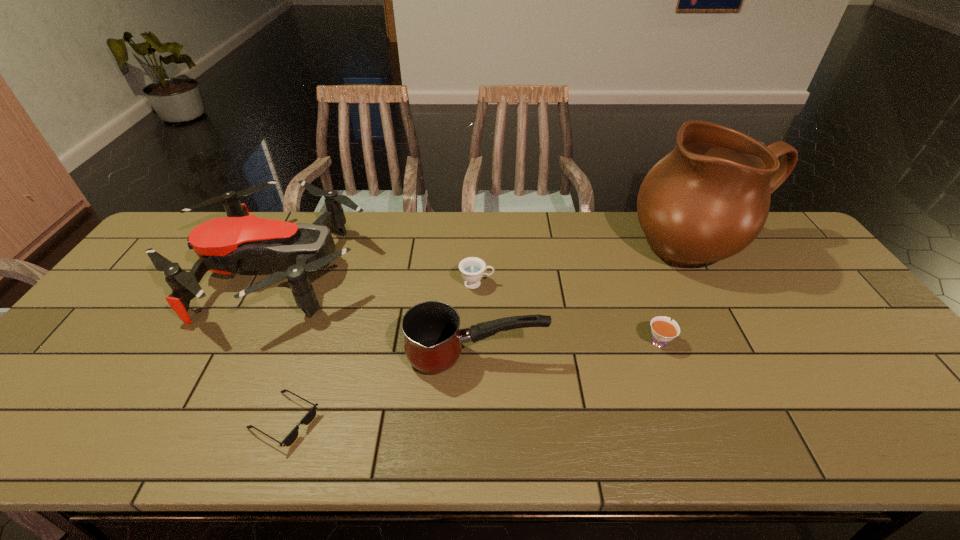
You are a GUI agent. You are given a task and a screenshot of the screen. Output one action in this format:
    pyautogui.click(x=<x>, y=<y>)
    Task: Click on the free spot that satisfies the following two spatial constraints: 1. at the spout of the tallest object; 2. on the handle side of the saucepan
    This screenshot has height=540, width=960.
    Given the screenshot: What is the action you would take?
    pyautogui.click(x=761, y=357)

I want to click on vacant region that satisfies the following two spatial constraints: 1. at the spout of the cream pitcher; 2. on the lenses of the nearest object, so click(x=797, y=421).

At what (x,y) coordinates should I click in order to perform the action: click on vacant space that satisfies the following two spatial constraints: 1. on the side of the right teacup with the handle; 2. on the camera side of the drone. Please return your answer as a coordinate pair (x, y). The width and height of the screenshot is (960, 540). Looking at the image, I should click on (632, 270).

This screenshot has width=960, height=540. Identify the location of free spot that satisfies the following two spatial constraints: 1. on the side of the nearer teacup with the handle; 2. on the side of the left teacup with the handle. (636, 284).